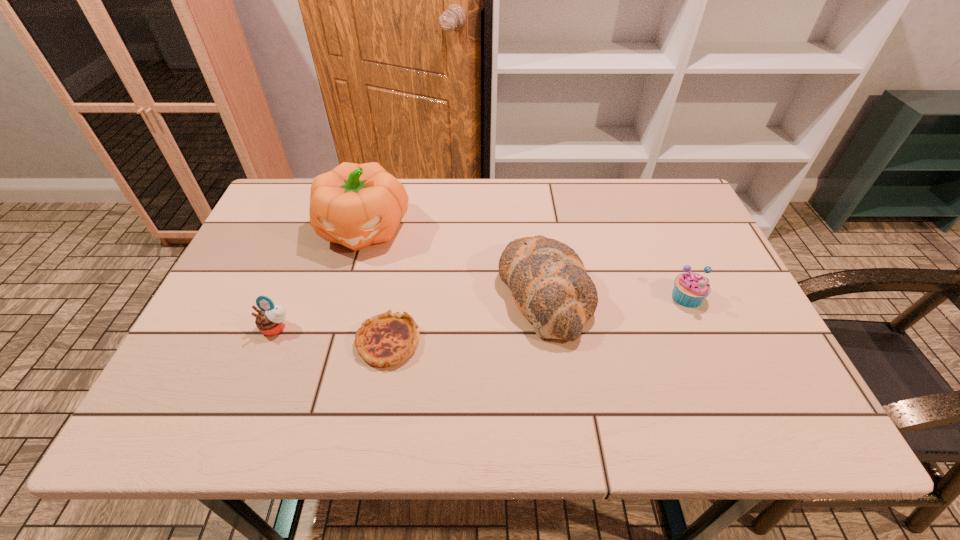
This screenshot has width=960, height=540. What are the coordinates of `the tallest object` in the screenshot? It's located at (356, 205).

Find the location of `bread`. bread is located at coordinates (550, 287).

The width and height of the screenshot is (960, 540). Identify the location of the second tallest object. (550, 287).

The height and width of the screenshot is (540, 960). What are the coordinates of `the nearer muffin` in the screenshot? It's located at (271, 319).

Find the location of a particular element. the rightmost object is located at coordinates (690, 289).

Image resolution: width=960 pixels, height=540 pixels. What are the coordinates of `the right muffin` in the screenshot? It's located at (690, 289).

The height and width of the screenshot is (540, 960). I want to click on quiche, so click(385, 340).

Identify the location of free location located on the carved face of the tallest object. This screenshot has height=540, width=960. (328, 353).

This screenshot has height=540, width=960. Identify the location of vacant space situated on the right of the fourth object from left to right. click(718, 292).

Locate an element on the screen. vacant region located on the front-facing side of the nearer muffin is located at coordinates (232, 436).